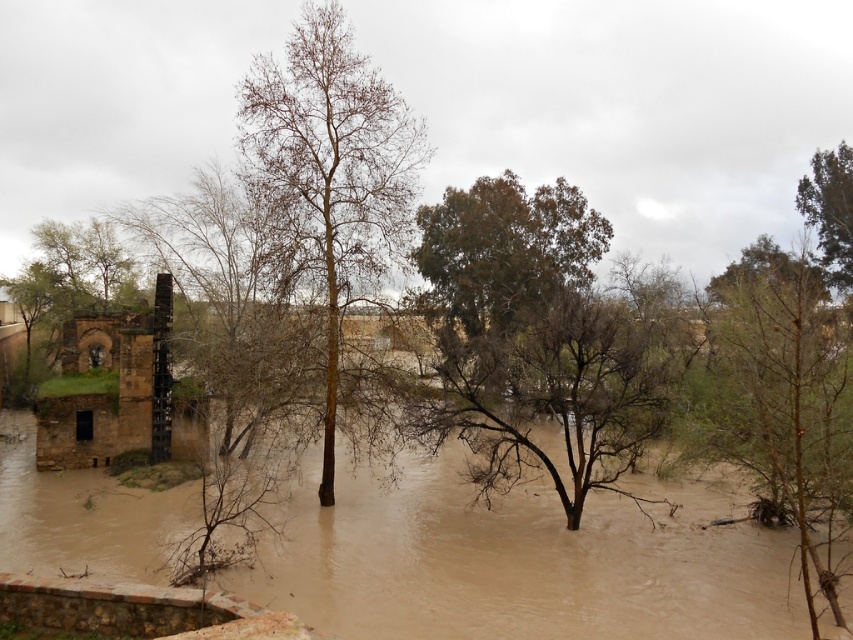
Between point (338, 304) and point (830, 196), which one is positioned behind?

The point (830, 196) is more distant.

Image resolution: width=853 pixels, height=640 pixels. What are the coordinates of `bare wood tree at center` in the screenshot? It's located at (332, 170).

Which is above, bare wood tree at center or green leafy tree at center?

Positioned higher is green leafy tree at center.

Locate an element on the screen. This screenshot has width=853, height=640. bare wood tree at center is located at coordinates (332, 170).

Between point (354, 586) and point (392, 131), which one is positioned in front?

Point (354, 586) is more forward.

Is point (409, 573) farther from camera compared to point (296, 116)?

No.

Identify the location of brown muddy water at center. (519, 561).